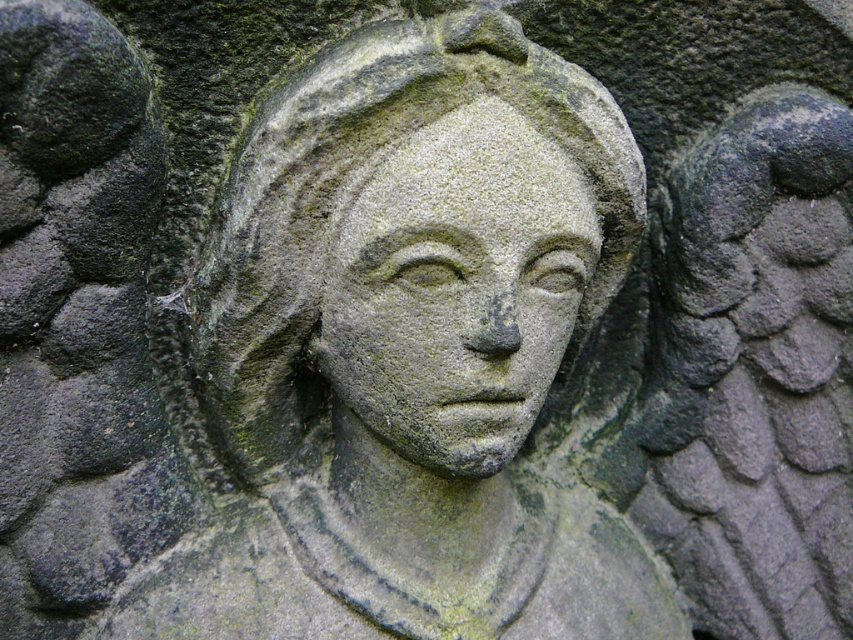
Question: Can you confirm if green stone carving at center is bigger than green stone face at center?

Choices:
 (A) no
 (B) yes

Answer: (B)

Question: Which point appears farthest from the camera in this image?

Choices:
 (A) (285, 310)
 (B) (357, 276)

Answer: (A)

Question: Can you confirm if green stone carving at center is smaller than green stone face at center?

Choices:
 (A) yes
 (B) no

Answer: (B)

Question: Does green stone carving at center have a greater width compared to green stone face at center?

Choices:
 (A) yes
 (B) no

Answer: (A)